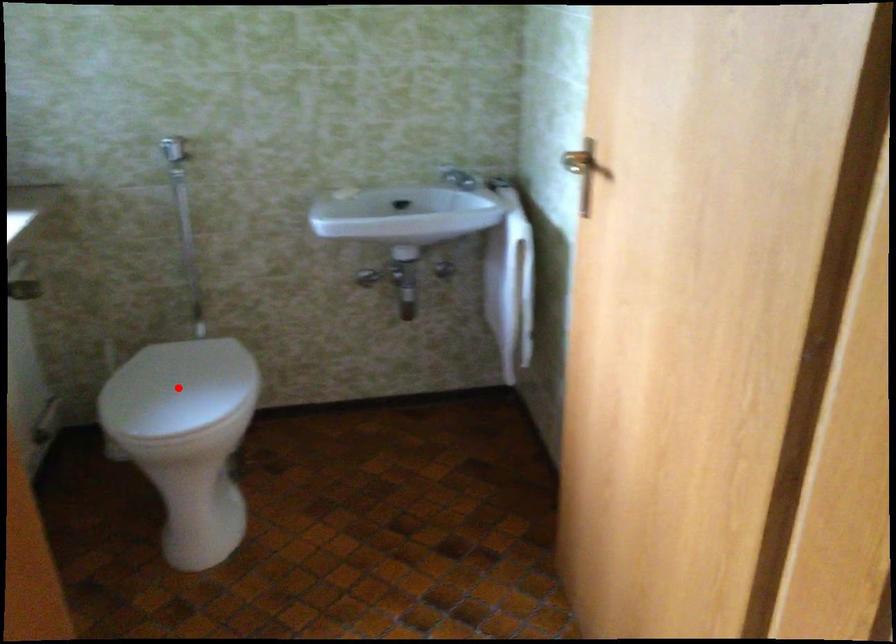
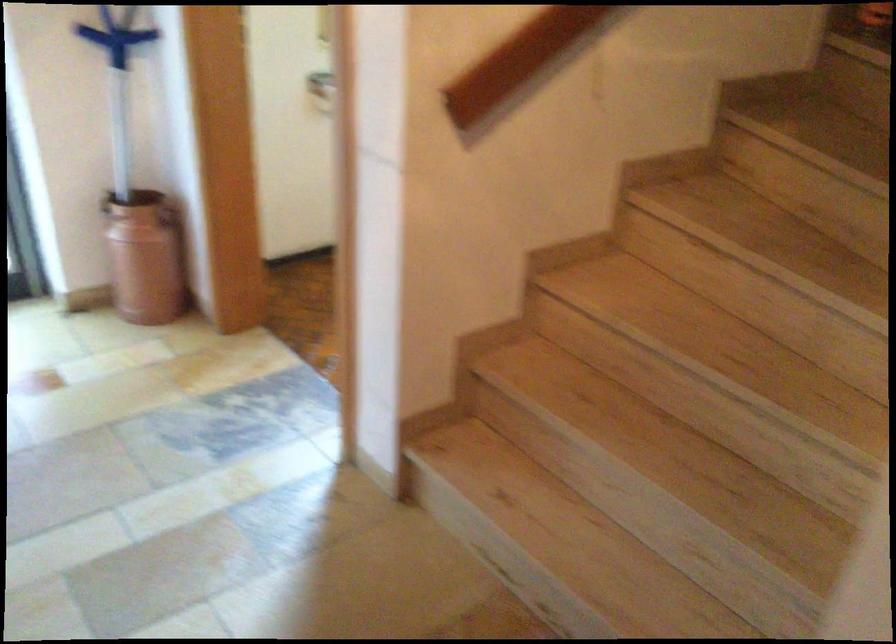
Question: I am providing you with two images of the same scene from different viewpoints. A red point is marked on the first image. Can you still see the location of the red point in image 2?

Choices:
 (A) Yes
 (B) No

Answer: (B)